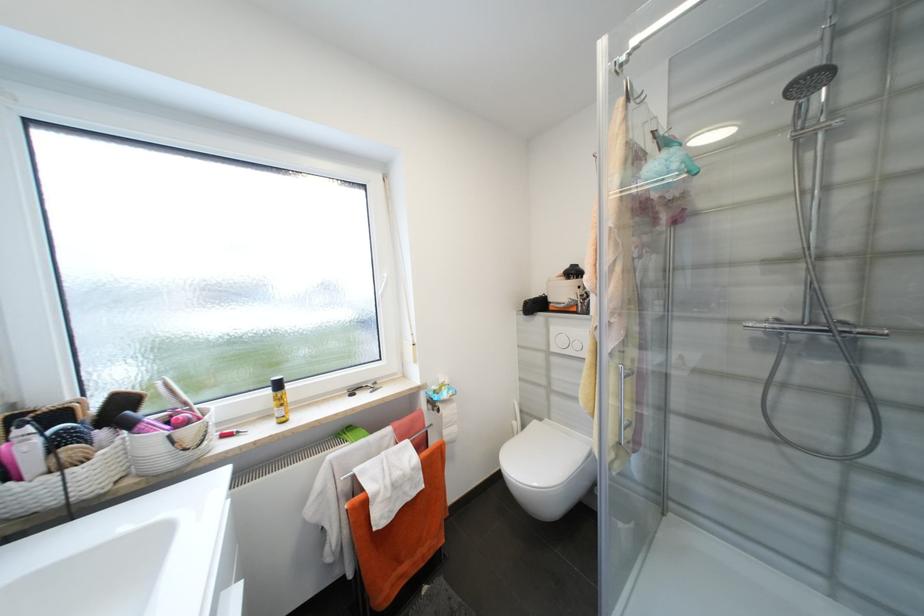
Locate an element on the screen. shower door handle is located at coordinates (621, 415).